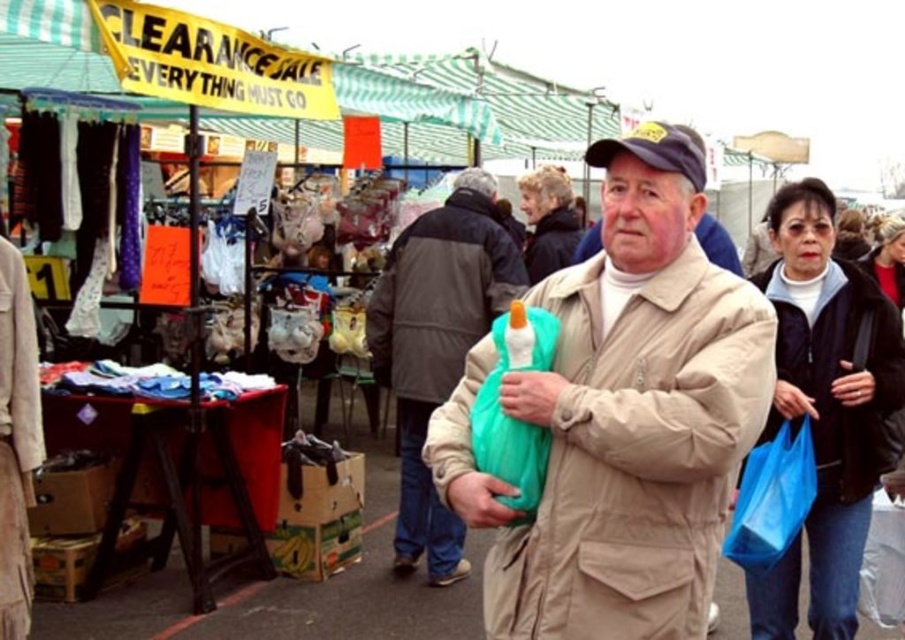
You are a shopper at the market and notice the tan matte trench coat at center and the matte plastic bag at center. Which item is shorter in height?

The tan matte trench coat at center is shorter in height than the matte plastic bag at center.

Based on the photo, you are standing in the market and notice a tan matte trench coat at center and a matte plastic bag at center. Which item is closer to you?

The tan matte trench coat at center is closer to the viewer than the matte plastic bag at center.